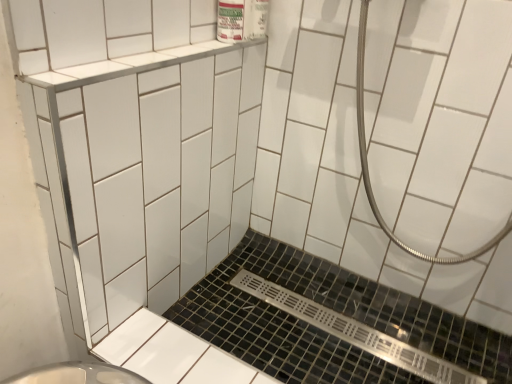
What is the approximate width of black metal drain at lower center?

The width of black metal drain at lower center is 38.54 centimeters.

I want to click on black metal drain at lower center, so click(322, 330).

Describe the element at coordinates (322, 330) in the screenshot. This screenshot has height=384, width=512. I see `black metal drain at lower center` at that location.

Find the location of a particular element. black metal drain at lower center is located at coordinates pos(322,330).